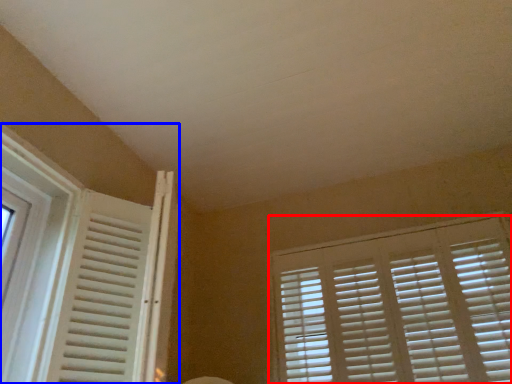
Question: Which of the following is the farthest to the observer, window blind (highlighted by a red box) or window (highlighted by a blue box)?

Choices:
 (A) window blind
 (B) window

Answer: (A)